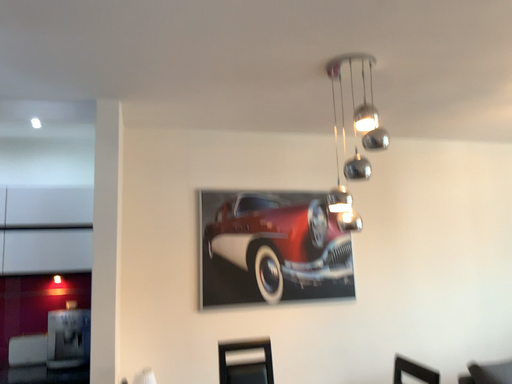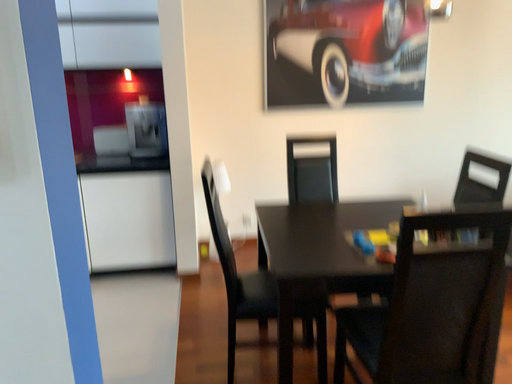
Question: Which way did the camera rotate in the video?

Choices:
 (A) rotated left
 (B) rotated right

Answer: (A)